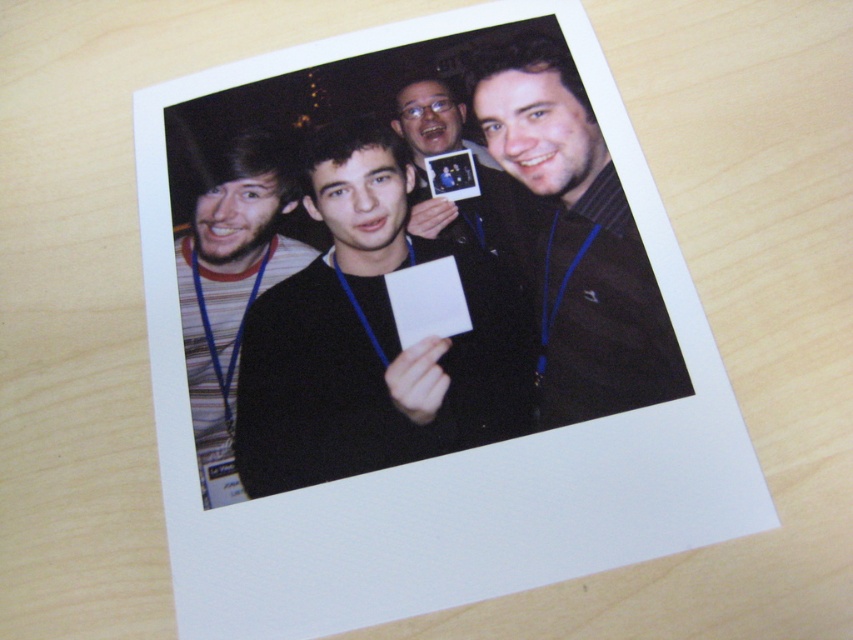
Between striped fabric shirt at left and matte black photo frame at center, which one is positioned lower?

striped fabric shirt at left

Looking at this image, between striped fabric shirt at left and matte black photo frame at center, which one has more height?

striped fabric shirt at left is taller.

Does point (270, 161) come farther from viewer compared to point (488, 221)?

Yes, it is.

Locate an element on the screen. The width and height of the screenshot is (853, 640). striped fabric shirt at left is located at coordinates (230, 280).

Can you confirm if black matte jacket at center is thinner than striped fabric shirt at left?

No, black matte jacket at center is not thinner than striped fabric shirt at left.

Does black matte jacket at center appear under striped fabric shirt at left?

No.

Where is `black matte jacket at center`? black matte jacket at center is located at coordinates (577, 237).

This screenshot has width=853, height=640. Find the location of `black matte jacket at center`. black matte jacket at center is located at coordinates (577, 237).

Looking at this image, does black matte sweater at center appear on the left side of black matte jacket at center?

Correct, you'll find black matte sweater at center to the left of black matte jacket at center.

You are a GUI agent. You are given a task and a screenshot of the screen. Output one action in this format:
    pyautogui.click(x=<x>, y=<y>)
    Task: Click on the black matte sweater at center
    This screenshot has width=853, height=640.
    Given the screenshot: What is the action you would take?
    pyautogui.click(x=372, y=336)